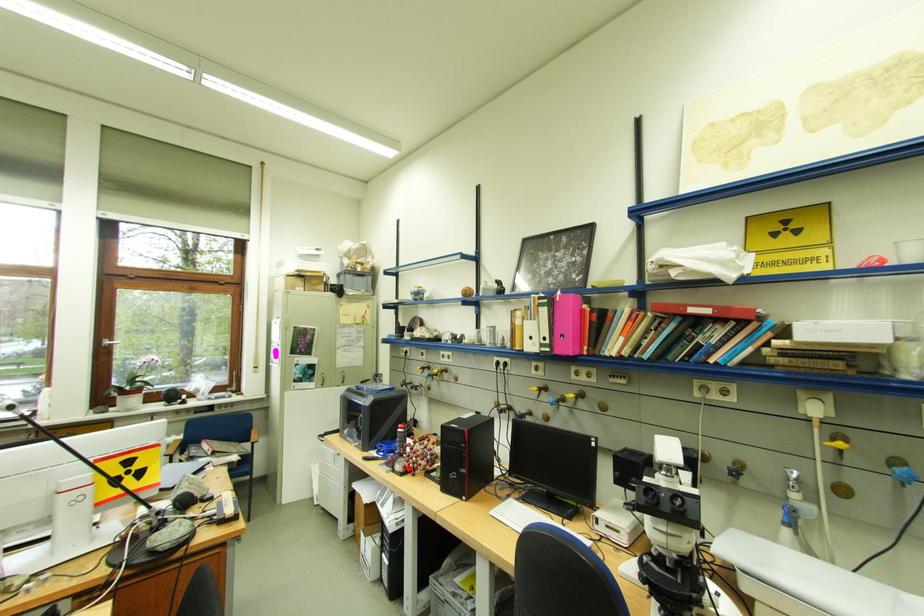
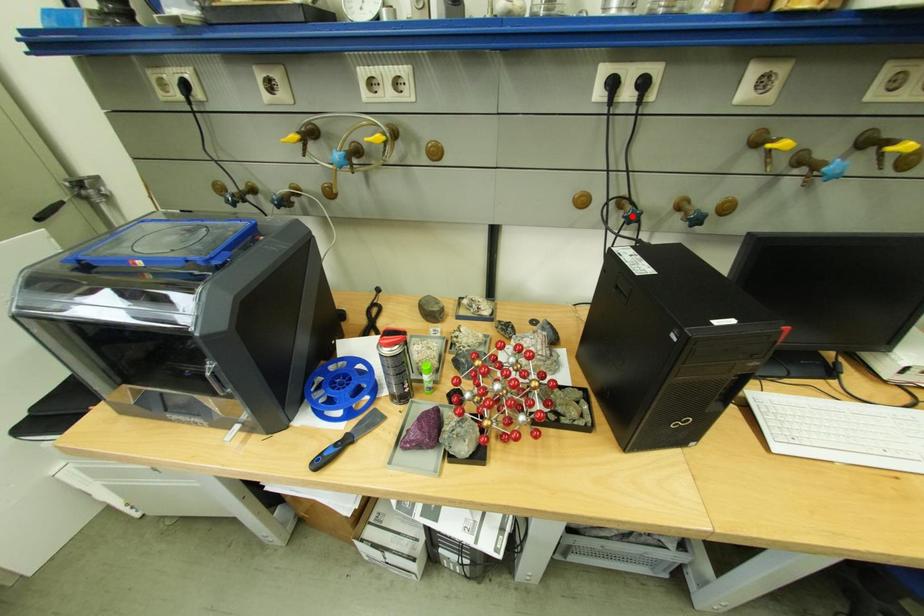
I am providing you with two images of the same scene from different viewpoints. A red point is marked on the first image and another point is marked on the second image. Is the red point in image1 aligned with the point shown in image2?

No